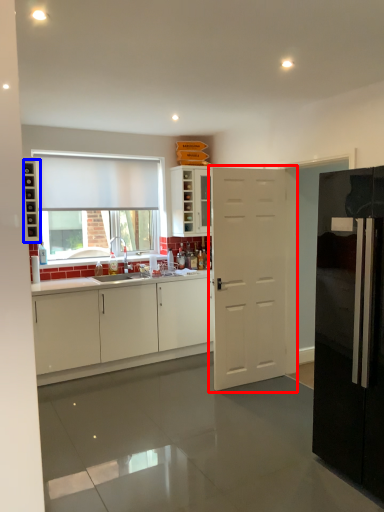
Question: Which object appears closest to the camera in this image, door (highlighted by a red box) or shelf (highlighted by a blue box)?

Choices:
 (A) door
 (B) shelf

Answer: (A)